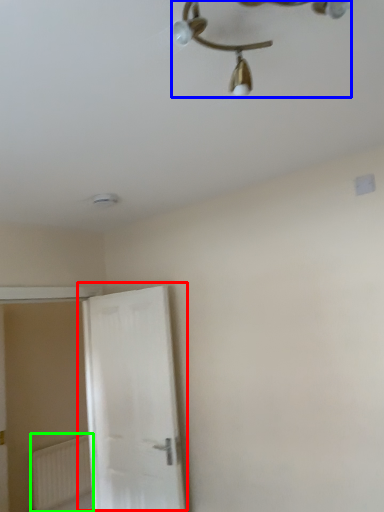
Question: Considering the real-world distances, which object is farthest from door (highlighted by a red box)? lamp (highlighted by a blue box) or radiator (highlighted by a green box)?

Choices:
 (A) lamp
 (B) radiator

Answer: (A)